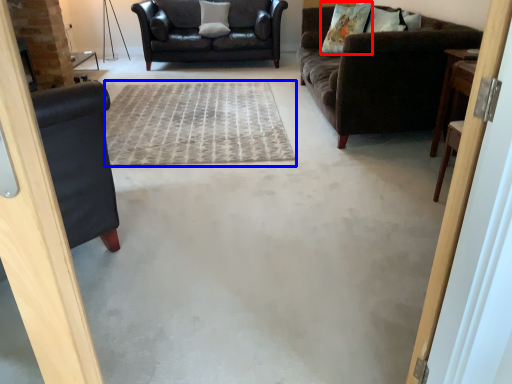
Question: Which point is further to the camera, pillow (highlighted by a red box) or plain (highlighted by a blue box)?

Choices:
 (A) pillow
 (B) plain

Answer: (A)